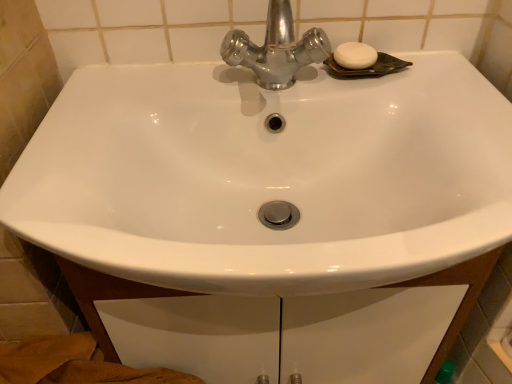
Question: Considering the positions of shiny metallic faucet at upper center and white matte soap at upper right in the image, is shiny metallic faucet at upper center taller or shorter than white matte soap at upper right?

Choices:
 (A) tall
 (B) short

Answer: (A)

Question: From the image's perspective, is shiny metallic faucet at upper center above or below white matte soap at upper right?

Choices:
 (A) below
 (B) above

Answer: (A)

Question: Is point (292, 54) positioned closer to the camera than point (349, 41)?

Choices:
 (A) farther
 (B) closer

Answer: (B)

Question: From the image's perspective, is white matte soap at upper right located above or below shiny metallic faucet at upper center?

Choices:
 (A) below
 (B) above

Answer: (B)

Question: Would you say white matte soap at upper right is inside or outside shiny metallic faucet at upper center?

Choices:
 (A) outside
 (B) inside

Answer: (A)

Question: Is white matte soap at upper right in front of or behind shiny metallic faucet at upper center in the image?

Choices:
 (A) behind
 (B) front

Answer: (A)

Question: From their relative heights in the image, would you say white matte soap at upper right is taller or shorter than shiny metallic faucet at upper center?

Choices:
 (A) short
 (B) tall

Answer: (A)